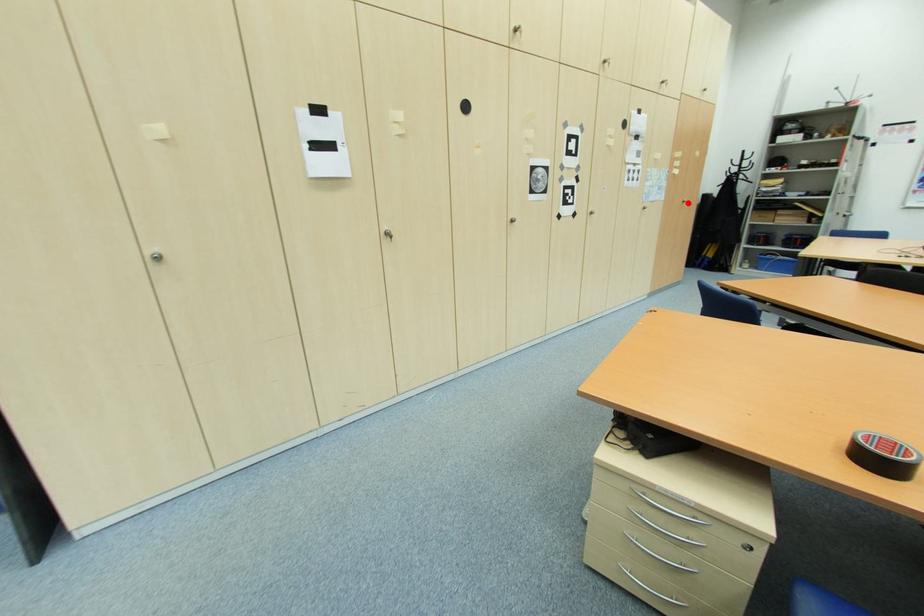
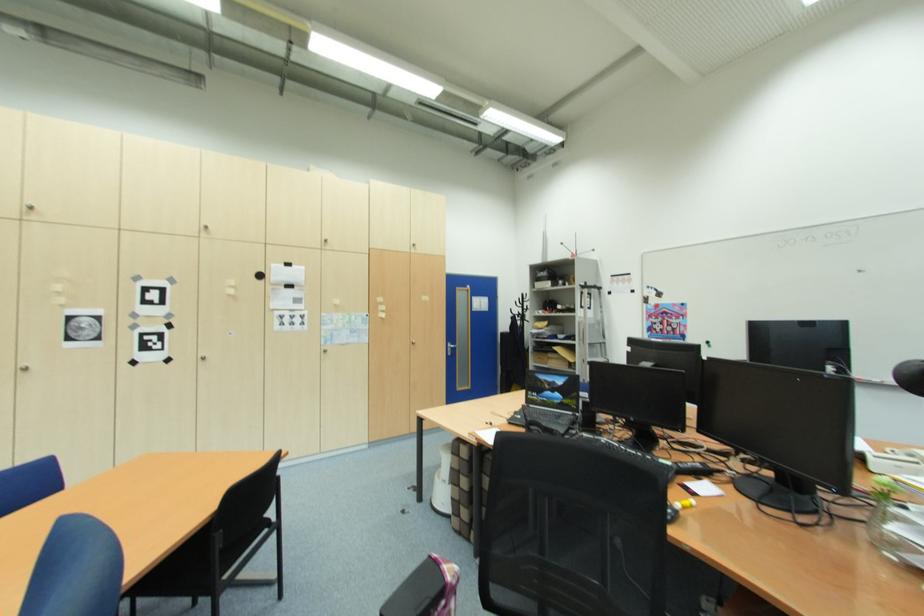
In the second image, find the point that corresponds to the highlighted location in the first image.

(418, 345)